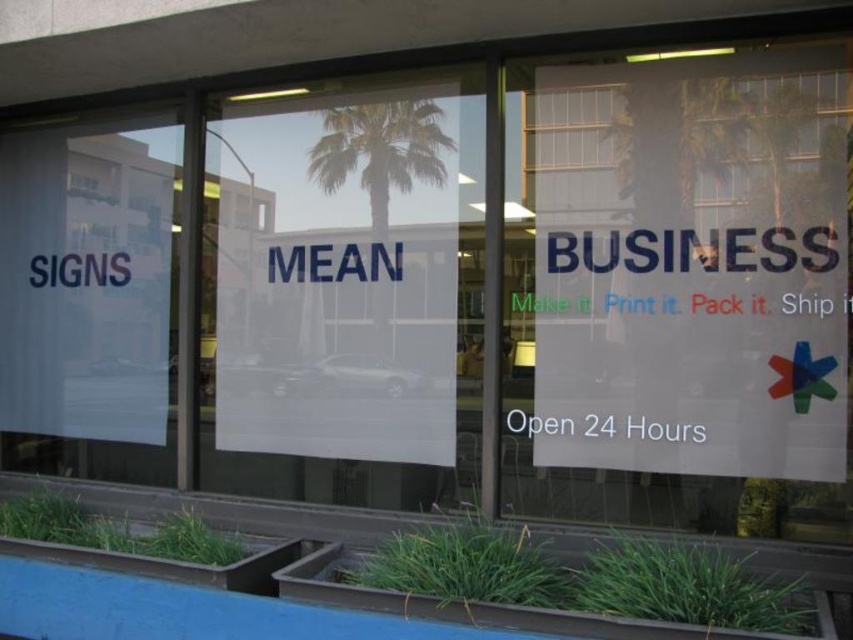
You are standing in front of the business window and notice the transparent paper sign at left. Can you determine its exact position based on the window sections?

The transparent paper sign at left is located at point (90, 298), which places it in the left section of the window.

You are a customer looking at the front window of a business. You notice the transparent paper sign at left and the green leafy palm tree at center. Which object is taller?

The transparent paper sign at left is much taller than the green leafy palm tree at center.